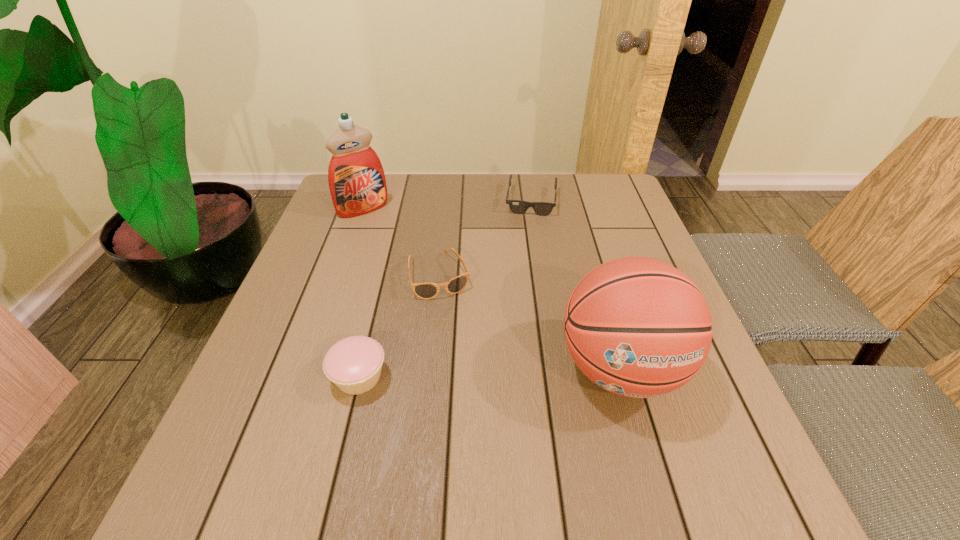
You are a GUI agent. You are given a task and a screenshot of the screen. Output one action in this format:
    pyautogui.click(x=<x>, y=<y>)
    Task: Click on the third shortest object
    
    Given the screenshot: What is the action you would take?
    pyautogui.click(x=353, y=364)

Where is `basketball`? This screenshot has width=960, height=540. basketball is located at coordinates (638, 327).

At what (x,y) coordinates should I click in order to perform the action: click on the right sunglasses. Please return your answer as a coordinate pair (x, y). Image resolution: width=960 pixels, height=540 pixels. Looking at the image, I should click on (516, 206).

Locate an element on the screen. This screenshot has width=960, height=540. detergent is located at coordinates (356, 178).

At what (x,y) coordinates should I click in order to perform the action: click on the third object from left to right. Please return your answer as a coordinate pair (x, y). The image size is (960, 540). Looking at the image, I should click on (455, 285).

Locate an element on the screen. the third nearest object is located at coordinates (x=455, y=285).

This screenshot has height=540, width=960. I want to click on free point located on the left of the cupcake, so click(x=267, y=377).

Where is `free space located on the temples of the right sunglasses`? The width and height of the screenshot is (960, 540). free space located on the temples of the right sunglasses is located at coordinates (528, 235).

Locate an element on the screen. free space located 0.070m on the temples of the right sunglasses is located at coordinates tap(528, 231).

Identify the location of vacant space located 0.330m on the temples of the right sunglasses. (521, 298).